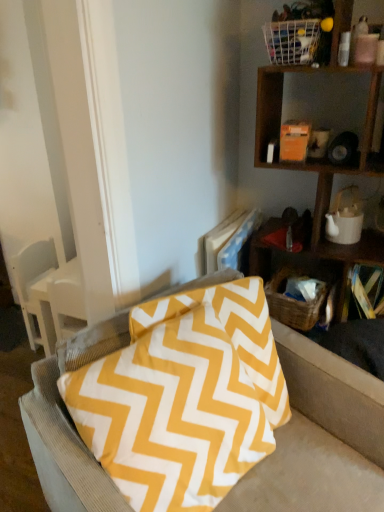
Describe the element at coordinates (323, 160) in the screenshot. I see `wooden shelf at upper right` at that location.

Based on the photo, what is the approximate height of white ceramic teapot at upper right?

white ceramic teapot at upper right is 20.68 centimeters in height.

Describe the element at coordinates (184, 398) in the screenshot. Image resolution: width=384 pixels, height=512 pixels. I see `yellow fabric pillow at center` at that location.

In order to face yellow fabric pillow at center, should I rotate leftwards or rightwards?

Turn left approximately 2.539 degrees to face it.

Measure the distance between point (316, 44) and camera.

They are 4.35 feet apart.

You are a GUI agent. You are given a task and a screenshot of the screen. Output one action in this format:
    pyautogui.click(x=<x>, y=<y>)
    Task: Click on the wooden shelf at upper right
    The width and height of the screenshot is (384, 512).
    Given the screenshot: What is the action you would take?
    pyautogui.click(x=323, y=160)

Between point (326, 209) and point (269, 282), which one is positioned in front?

Point (326, 209)

Is white ceramic teapot at upper right facing towards woven brown basket at lower right, the 1th basket positioned from the back?

No.

How many degrees apart are the facing directions of white ceramic teapot at upper right and woven brown basket at lower right, which appears as the first basket when ordered from the bottom?

The facing directions of white ceramic teapot at upper right and woven brown basket at lower right, which appears as the first basket when ordered from the bottom, are 10.1 degrees apart.

From the image's perspective, is white ceramic teapot at upper right located above or below woven brown basket at lower right, which ranks as the 2th basket in top-to-bottom order?

Clearly, from the image's perspective, white ceramic teapot at upper right is above woven brown basket at lower right, which ranks as the 2th basket in top-to-bottom order.

From the picture: From a real-world perspective, which is physically below, yellow fabric pillow at center or white ceramic teapot at upper right?

yellow fabric pillow at center.

Does yellow fabric pillow at center have a greater height compared to white ceramic teapot at upper right?

Yes.

From the image's perspective, would you say yellow fabric pillow at center is shown under white ceramic teapot at upper right?

Yes, from the image's perspective, yellow fabric pillow at center is beneath white ceramic teapot at upper right.

Considering the relative sizes of white wire basket at upper right, which is the second basket from back to front, and yellow fabric pillow at center in the image provided, is white wire basket at upper right, which is the second basket from back to front, wider than yellow fabric pillow at center?

Yes, white wire basket at upper right, which is the second basket from back to front, is wider than yellow fabric pillow at center.

Can you confirm if white wire basket at upper right, which ranks as the second basket in bottom-to-top order, is taller than yellow fabric pillow at center?

In fact, white wire basket at upper right, which ranks as the second basket in bottom-to-top order, may be shorter than yellow fabric pillow at center.

Is white wire basket at upper right, which ranks as the second basket in bottom-to-top order, not within yellow fabric pillow at center?

Yes, white wire basket at upper right, which ranks as the second basket in bottom-to-top order, is not within yellow fabric pillow at center.

Which object is further away from the camera taking this photo, white wire basket at upper right, which is the second basket from back to front, or yellow fabric pillow at center?

Positioned behind is white wire basket at upper right, which is the second basket from back to front.

Could you measure the distance between woven brown basket at lower right, placed as the second basket when sorted from front to back, and wooden shelf at upper right?

They are 14.05 inches apart.

Can wooden shelf at upper right be found inside woven brown basket at lower right, which ranks as the 2th basket in top-to-bottom order?

That's incorrect, wooden shelf at upper right is not inside woven brown basket at lower right, which ranks as the 2th basket in top-to-bottom order.

Consider the image. Considering the sizes of woven brown basket at lower right, the 1th basket positioned from the back, and wooden shelf at upper right in the image, is woven brown basket at lower right, the 1th basket positioned from the back, wider or thinner than wooden shelf at upper right?

woven brown basket at lower right, the 1th basket positioned from the back, is thinner than wooden shelf at upper right.

Starting from the wooden shelf at upper right, which basket is the 2nd one behind? Please provide its 2D coordinates.

[(293, 302)]

Is woven brown basket at lower right, the 1th basket positioned from the back, in front of or behind white ceramic teapot at upper right in the image?

Visually, woven brown basket at lower right, the 1th basket positioned from the back, is located behind white ceramic teapot at upper right.

Locate an element on the screen. Image resolution: width=384 pixels, height=512 pixels. the 1st basket counting from the left of the white ceramic teapot at upper right is located at coordinates (293, 302).

Is white ceramic teapot at upper right touching wooden shelf at upper right?

No, white ceramic teapot at upper right is not with wooden shelf at upper right.

From the image's perspective, which one is positioned lower, white ceramic teapot at upper right or wooden shelf at upper right?

white ceramic teapot at upper right, from the image's perspective.

Identify the location of shelf that is above the white ceramic teapot at upper right (from the image's perspective). The width and height of the screenshot is (384, 512). [x=323, y=160].

Is white ceramic teapot at upper right facing towards yellow zigzag-patterned pillow at right?

No.

Is the position of white ceramic teapot at upper right less distant than that of yellow zigzag-patterned pillow at right?

Yes.

Does white ceramic teapot at upper right appear on the right side of yellow zigzag-patterned pillow at right?

No.

How far apart are white ceramic teapot at upper right and yellow zigzag-patterned pillow at right?

white ceramic teapot at upper right and yellow zigzag-patterned pillow at right are 10.60 inches apart.

Identify the location of basket below the white ceramic teapot at upper right (from a real-world perspective). (293, 302).

In the image, there is a yellow fabric pillow at center. Find the location of `cabinet above it (from the image's perspective)`. cabinet above it (from the image's perspective) is located at coordinates (321, 207).

From the picture: Considering their positions, is yellow fabric pillow at center positioned further to wooden shelf at upper right than white ceramic teapot at upper right?

yellow fabric pillow at center is positioned further to the anchor wooden shelf at upper right.

Looking at this image, when comparing their distances from white wire basket at upper right, the 1th basket positioned from the top, does yellow fabric pillow at center or wooden shelf at upper right seem closer?

wooden shelf at upper right is closer to white wire basket at upper right, the 1th basket positioned from the top.

From the image, which object appears to be farther from white wire basket at upper right, which ranks as the second basket in bottom-to-top order, woven brown basket at lower right, placed as the second basket when sorted from front to back, or white ceramic teapot at upper right?

woven brown basket at lower right, placed as the second basket when sorted from front to back.

Estimate the real-world distances between objects in this image. Which object is further from white ceramic teapot at upper right, yellow fabric pillow at center or white wire basket at upper right, positioned as the first basket in front-to-back order?

Based on the image, yellow fabric pillow at center appears to be further to white ceramic teapot at upper right.

Consider the image. Looking at the image, which one is located closer to white wire basket at upper right, which ranks as the second basket in bottom-to-top order, white ceramic teapot at upper right or yellow zigzag-patterned pillow at right?

Based on the image, white ceramic teapot at upper right appears to be nearer to white wire basket at upper right, which ranks as the second basket in bottom-to-top order.

Consider the image. Looking at the image, which one is located further to woven brown basket at lower right, the 1th basket positioned from the back, yellow fabric pillow at center or white ceramic teapot at upper right?

yellow fabric pillow at center.

Based on their spatial positions, is white ceramic teapot at upper right or yellow zigzag-patterned pillow at right further from woven brown basket at lower right, the 1th basket positioned from the back?

white ceramic teapot at upper right.

From the picture: From the image, which object appears to be nearer to yellow zigzag-patterned pillow at right, wooden shelf at upper right or white wire basket at upper right, which is the second basket from back to front?

wooden shelf at upper right.

At what (x,y) coordinates should I click in order to perform the action: click on cabinet between yellow fabric pillow at center and yellow zigzag-patterned pillow at right from front to back. Please return your answer as a coordinate pair (x, y). Looking at the image, I should click on (321, 207).

This screenshot has width=384, height=512. Find the location of `shelf between white wire basket at upper right, the 1th basket positioned from the top, and white ceramic teapot at upper right from top to bottom`. shelf between white wire basket at upper right, the 1th basket positioned from the top, and white ceramic teapot at upper right from top to bottom is located at coordinates (323, 160).

The width and height of the screenshot is (384, 512). Identify the location of cabinet between white wire basket at upper right, which ranks as the second basket in bottom-to-top order, and yellow zigzag-patterned pillow at right in the up-down direction. (321, 207).

The image size is (384, 512). Identify the location of cabinet positioned between wooden shelf at upper right and woven brown basket at lower right, the 1th basket positioned from the back, from near to far. (321, 207).